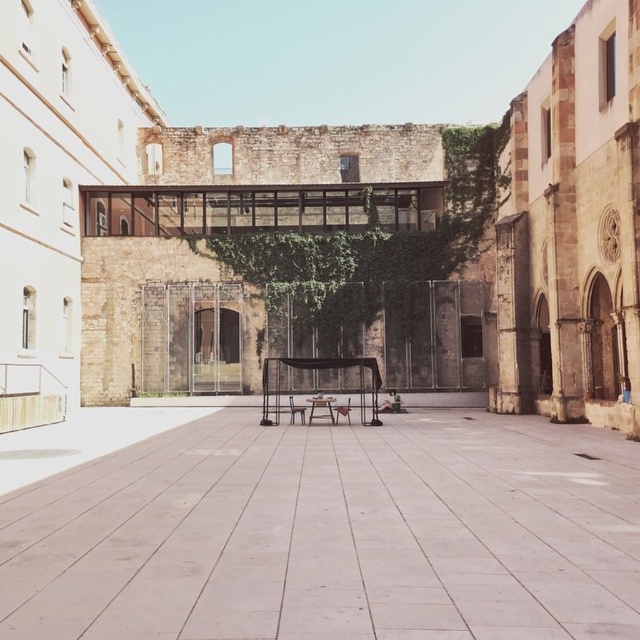
Question: Which point is closer to the camera?

Choices:
 (A) (291, 396)
 (B) (580, 529)

Answer: (B)

Question: Among these points, which one is nearest to the camera?

Choices:
 (A) (292, 417)
 (B) (209, 477)

Answer: (B)

Question: Which object appears farthest from the camera in this image?

Choices:
 (A) wooden chair at center
 (B) smooth concrete alley at center

Answer: (A)

Question: Is smooth concrete alley at center smaller than wooden chair at center?

Choices:
 (A) yes
 (B) no

Answer: (B)

Question: Is smooth concrete alley at center bigger than wooden chair at center?

Choices:
 (A) yes
 (B) no

Answer: (A)

Question: Is smooth concrete alley at center to the left of wooden chair at center from the viewer's perspective?

Choices:
 (A) no
 (B) yes

Answer: (A)